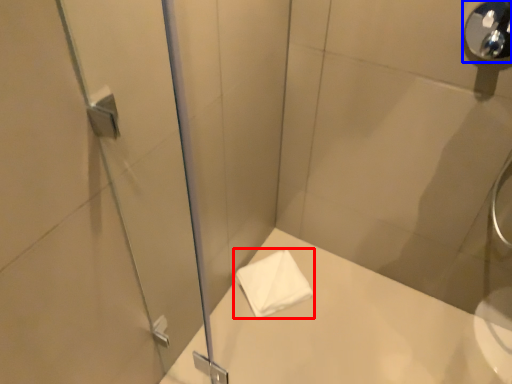
Question: Which point is further to the camera, towel (highlighted by a red box) or shower (highlighted by a blue box)?

Choices:
 (A) towel
 (B) shower

Answer: (A)